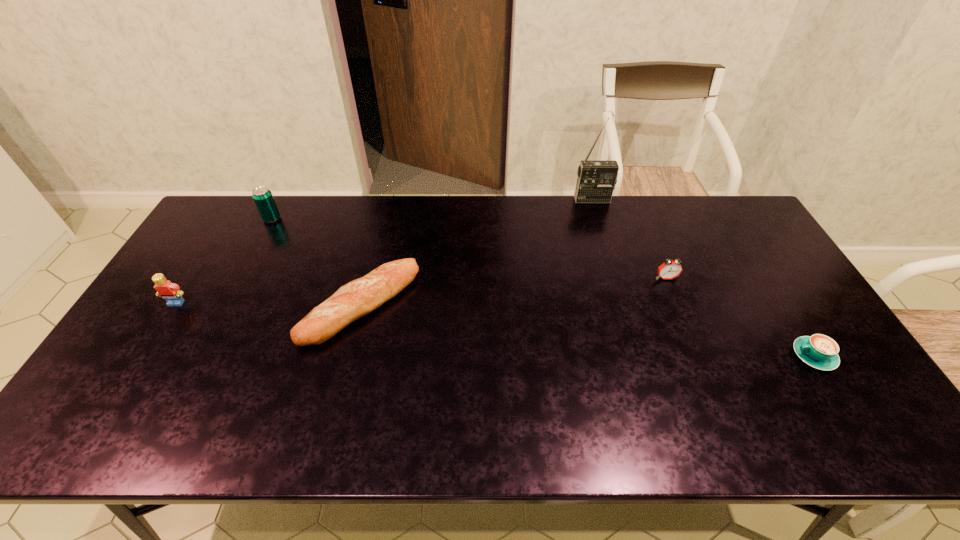
I want to click on free space between the baguet and the shortest object, so click(588, 330).

Find the location of `empty space between the rightmost object and the beer can`. empty space between the rightmost object and the beer can is located at coordinates (542, 287).

I want to click on free spot between the alarm clock and the third object from left to right, so click(514, 291).

You are a GUI agent. You are given a task and a screenshot of the screen. Output one action in this format:
    pyautogui.click(x=<x>, y=<y>)
    Task: Click on the free space that is in between the baguet and the radio receiver
    This screenshot has height=540, width=960.
    Given the screenshot: What is the action you would take?
    pyautogui.click(x=477, y=252)

At what (x,y) coordinates should I click in order to perform the action: click on free space between the Lego and the cappuccino. Please return your answer as a coordinate pair (x, y). This screenshot has width=960, height=540. Looking at the image, I should click on [495, 329].

Identify which object is located as the nearest to the shortest object. Please provide its 2D coordinates. Your answer should be formatted as a tuple, i.e. [(x, y)], where the tuple contains the x and y coordinates of a point satisfying the conditions above.

[(669, 269)]

At what (x,y) coordinates should I click in order to perform the action: click on object identified as the fourth closest to the fifth object from left to right. Please return your answer as a coordinate pair (x, y). The width and height of the screenshot is (960, 540). Looking at the image, I should click on (262, 196).